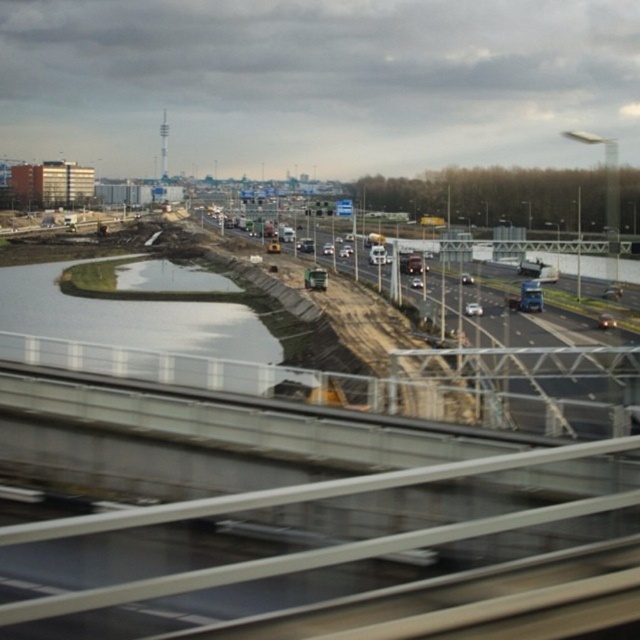
You are a delivery driver who needs to cross the highway. You see the concrete asphalt highway at center and the smooth concrete water at lower left. Which direction should you turn to reach the highway from the water?

The concrete asphalt highway at center is to the right of the smooth concrete water at lower left, so you should turn right to reach the highway from the water.

You are driving a car and need to cross the highway. You see the concrete asphalt highway at center and the smooth concrete water at lower left. Which one is closer to you?

The concrete asphalt highway at center is closer to the viewer than the smooth concrete water at lower left, so the concrete asphalt highway at center is closer to you.